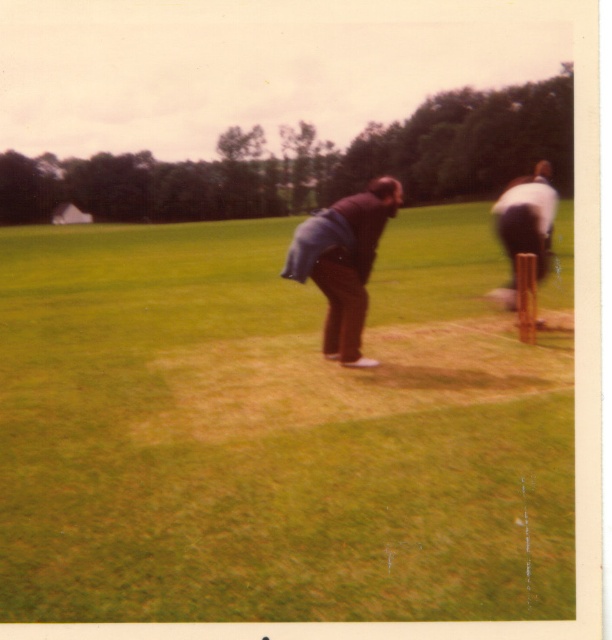
You are a gardener who needs to mow the lawn. There is a blue denim jacket at center lying on the green grass at center. Can you safely mow the grass without damaging the jacket?

The green grass at center is taller than the blue denim jacket at center, so you can safely mow the lawn without damaging the jacket as the grass is higher than the jacket.

You are a photographer trying to capture both the blue denim jacket at center and the white fabric shirt at right in a single frame. Based on their sizes, which one should you focus on to ensure both are clearly visible?

The blue denim jacket at center is smaller than the white fabric jacket at right, so focusing on the white fabric shirt at right would help ensure both are clearly visible as it is larger and easier to frame.